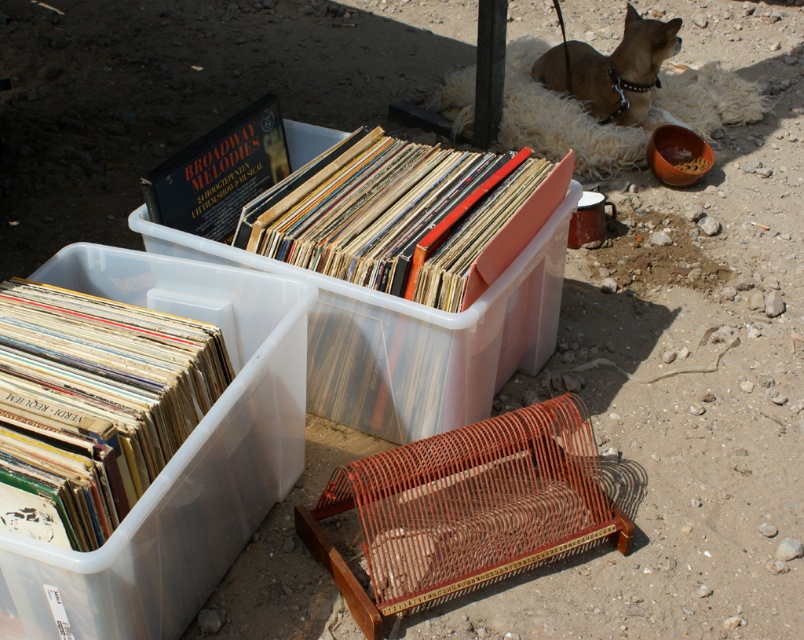
Question: Among these points, which one is nearest to the camera?

Choices:
 (A) (35, 376)
 (B) (470, 339)

Answer: (A)

Question: Does clear plastic container at upper center appear on the left side of matte vinyl records at center?

Choices:
 (A) no
 (B) yes

Answer: (B)

Question: Estimate the real-world distances between objects in this image. Which object is closer to the brown fur dog at upper right?

Choices:
 (A) matte vinyl records at center
 (B) clear plastic container at upper center

Answer: (A)

Question: Does hardcover book at upper center appear under brown fur dog at upper right?

Choices:
 (A) no
 (B) yes

Answer: (B)

Question: Is multicolored vinyl records at lower left smaller than brown fur dog at upper right?

Choices:
 (A) yes
 (B) no

Answer: (A)

Question: Which point appears closest to the camera in this image?

Choices:
 (A) (234, 200)
 (B) (567, 49)
 (C) (347, 368)
 (D) (408, 189)

Answer: (C)